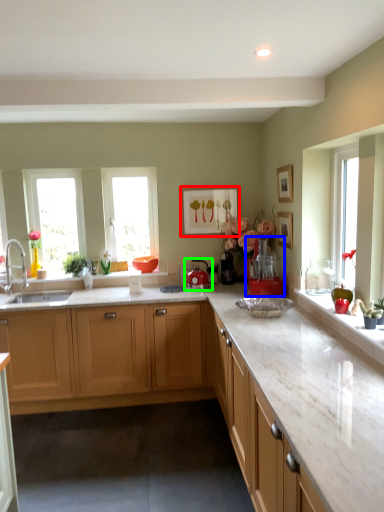
Question: Which object is the closest to the picture frame (highlighted by a red box)? Choose among these: coffee machine (highlighted by a blue box) or appliance (highlighted by a green box).

Choices:
 (A) coffee machine
 (B) appliance

Answer: (B)